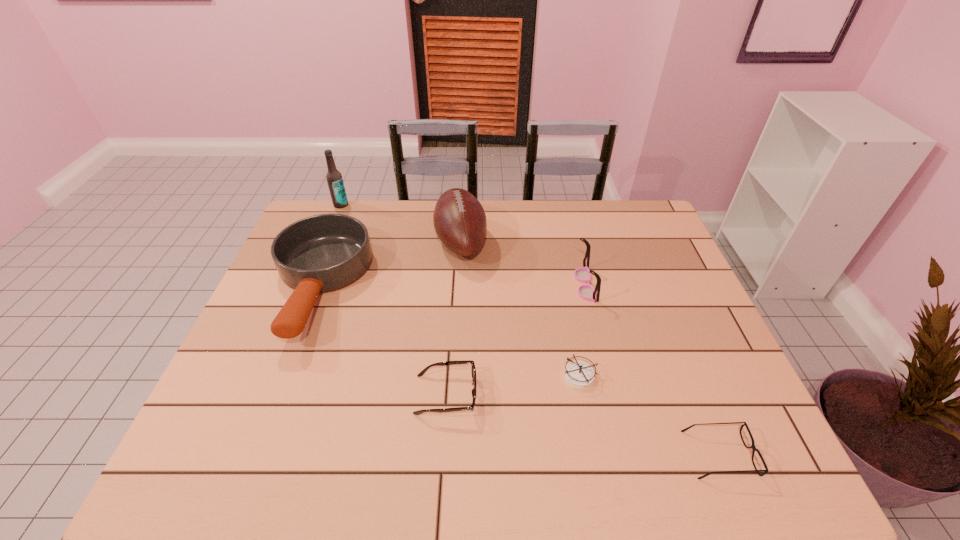
Locate an element on the screen. The height and width of the screenshot is (540, 960). vacant space that is in between the compass and the beer bottle is located at coordinates (460, 291).

Find the location of a particular element. The height and width of the screenshot is (540, 960). empty location between the beer bottle and the compass is located at coordinates tap(460, 291).

Locate an element on the screen. The image size is (960, 540). vacant space that's between the compass and the nearest spectacles is located at coordinates (649, 416).

Identify the location of free space between the compass and the beer bottle. (460, 291).

Identify which object is the fifth closest to the pan. Please provide its 2D coordinates. Your answer should be formatted as a tuple, i.e. [(x, y)], where the tuple contains the x and y coordinates of a point satisfying the conditions above.

[(586, 292)]

Identify which object is located as the second nearest to the pan. Please provide its 2D coordinates. Your answer should be formatted as a tuple, i.e. [(x, y)], where the tuple contains the x and y coordinates of a point satisfying the conditions above.

[(459, 219)]

Choose which spectacles is the second nearest neighbor to the second spectacles from left to right. Please provide its 2D coordinates. Your answer should be formatted as a tuple, i.e. [(x, y)], where the tuple contains the x and y coordinates of a point satisfying the conditions above.

[(752, 446)]

This screenshot has width=960, height=540. Identify the location of spectacles that can be found as the closest to the fourth tallest object. (473, 370).

Find the location of a particular element. free region that satisfies the following two spatial constraints: 1. on the front side of the sixth shortest object; 2. on the lenses of the leftmost spectacles is located at coordinates (453, 394).

At what (x,y) coordinates should I click in order to perform the action: click on free region that satisfies the following two spatial constraints: 1. on the handle side of the compass; 2. on the left side of the pan. Please return your answer as a coordinate pair (x, y). Looking at the image, I should click on (284, 376).